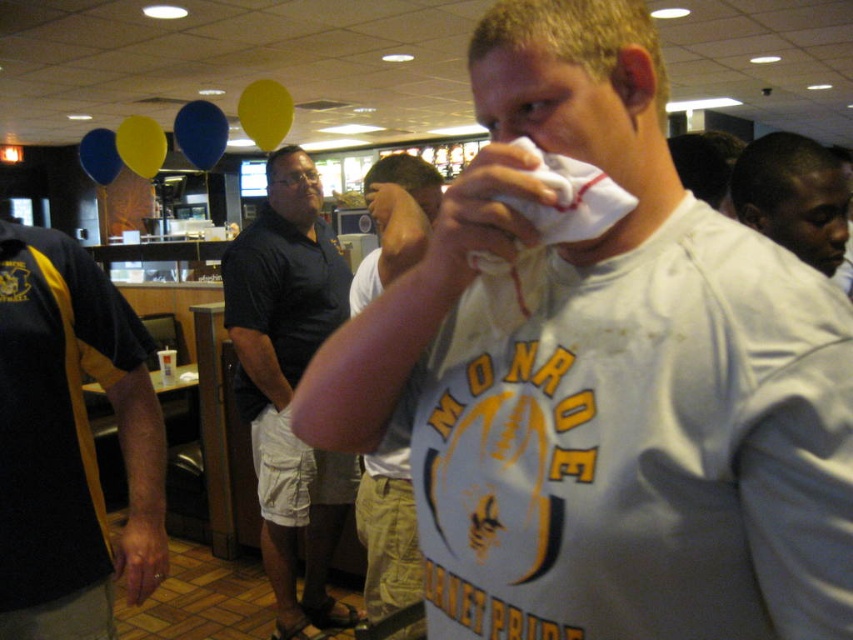
Question: Which of these objects is positioned farthest from the white cotton shirt at center?

Choices:
 (A) black smooth shirt at upper right
 (B) black fabric apron at left
 (C) dark blue polo shirt at center
 (D) gray cotton t-shirt at center

Answer: (C)

Question: Does dark blue polo shirt at center appear on the left side of black smooth shirt at upper right?

Choices:
 (A) yes
 (B) no

Answer: (A)

Question: Which of these objects is positioned closest to the gray cotton t-shirt at center?

Choices:
 (A) white cotton shirt at center
 (B) black smooth shirt at upper right

Answer: (A)

Question: Can you confirm if gray cotton t-shirt at center is positioned to the left of black smooth shirt at upper right?

Choices:
 (A) yes
 (B) no

Answer: (A)

Question: Which of the following is the farthest from the observer?

Choices:
 (A) (728, 412)
 (B) (399, 577)
 (C) (26, 268)
 (D) (256, 419)

Answer: (D)

Question: Can you confirm if white cotton shirt at center is positioned below black smooth shirt at upper right?

Choices:
 (A) yes
 (B) no

Answer: (A)